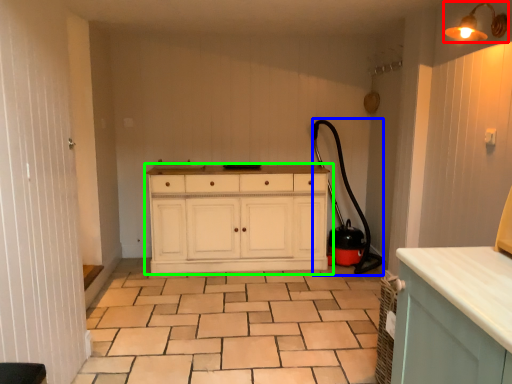
Question: Which object is positioned closest to light fixture (highlighted by a red box)? Select from garden hose (highlighted by a blue box) and chest of drawers (highlighted by a green box).

Choices:
 (A) garden hose
 (B) chest of drawers

Answer: (A)